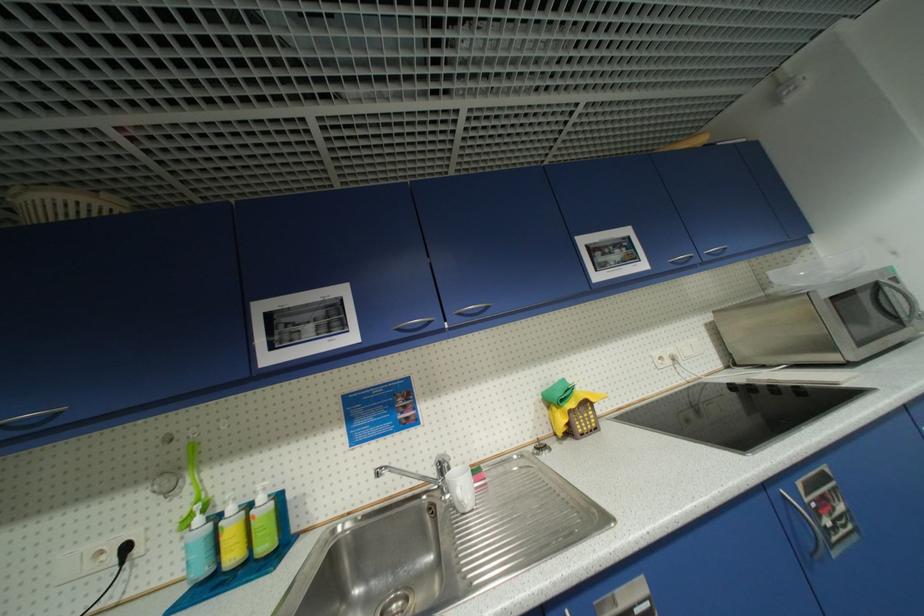
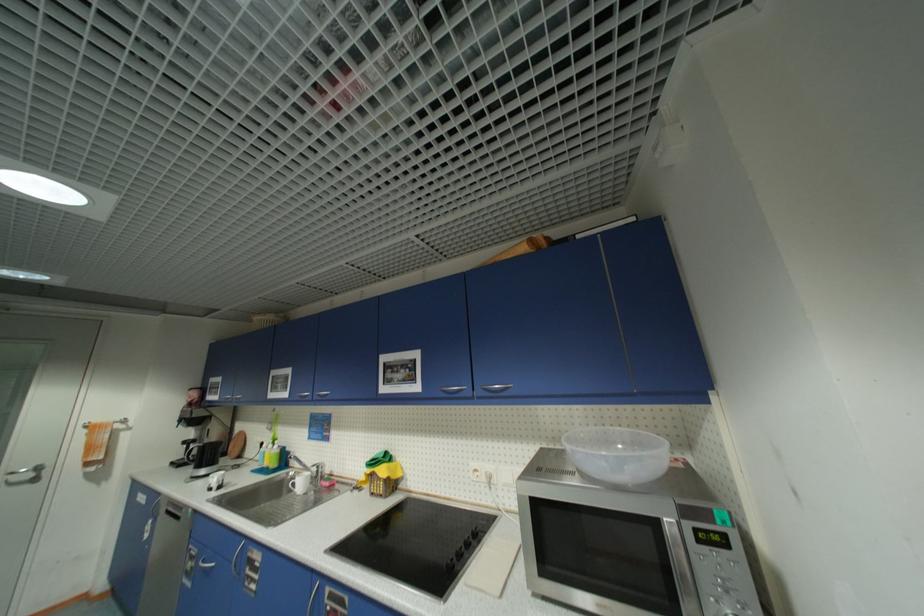
The point at (578, 406) is marked in the first image. Where is the corresponding point in the second image?

(374, 472)